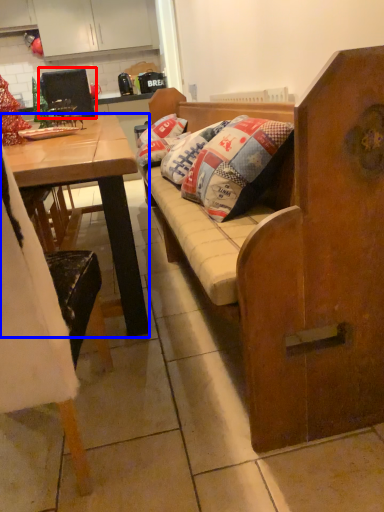
Question: Which of the following is the farthest to the observer, armchair (highlighted by a red box) or desk (highlighted by a blue box)?

Choices:
 (A) armchair
 (B) desk

Answer: (A)